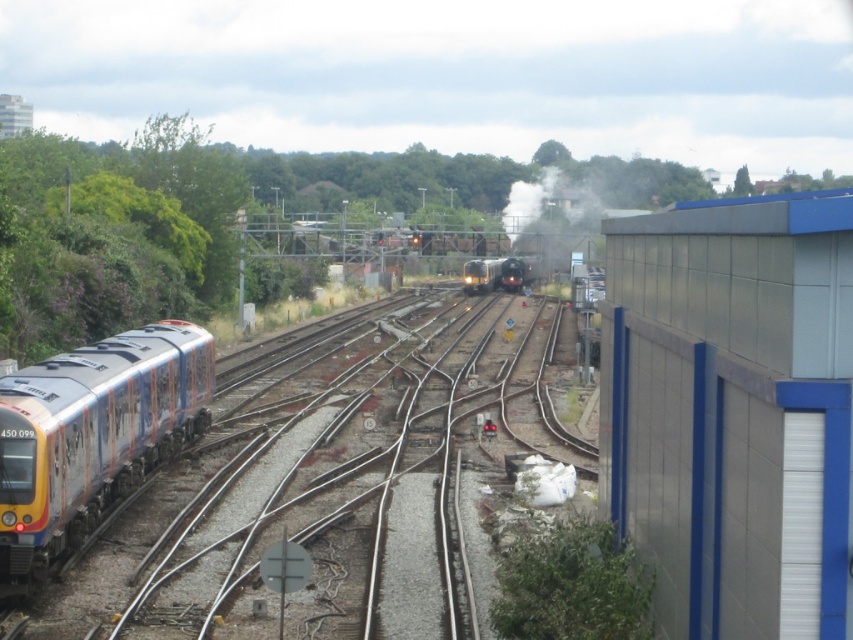
Identify the location of polished metallic train at left. Image resolution: width=853 pixels, height=640 pixels. (91, 435).

Can you confirm if metallic train tracks at left is positioned below shiny black train at center?

Yes, metallic train tracks at left is below shiny black train at center.

Is point (399, 413) farther from viewer compared to point (492, 262)?

No, (399, 413) is closer to viewer.

Is point (389, 616) positioned in front of point (520, 273)?

Yes, it is in front of point (520, 273).

The image size is (853, 640). Find the location of `metallic train tracks at left`. metallic train tracks at left is located at coordinates (335, 481).

Does polished metallic train at left have a greater width compared to shiny black train at center?

In fact, polished metallic train at left might be narrower than shiny black train at center.

Identify the location of polished metallic train at left. This screenshot has width=853, height=640. (91, 435).

Locate an element on the screen. Image resolution: width=853 pixels, height=640 pixels. polished metallic train at left is located at coordinates (91, 435).